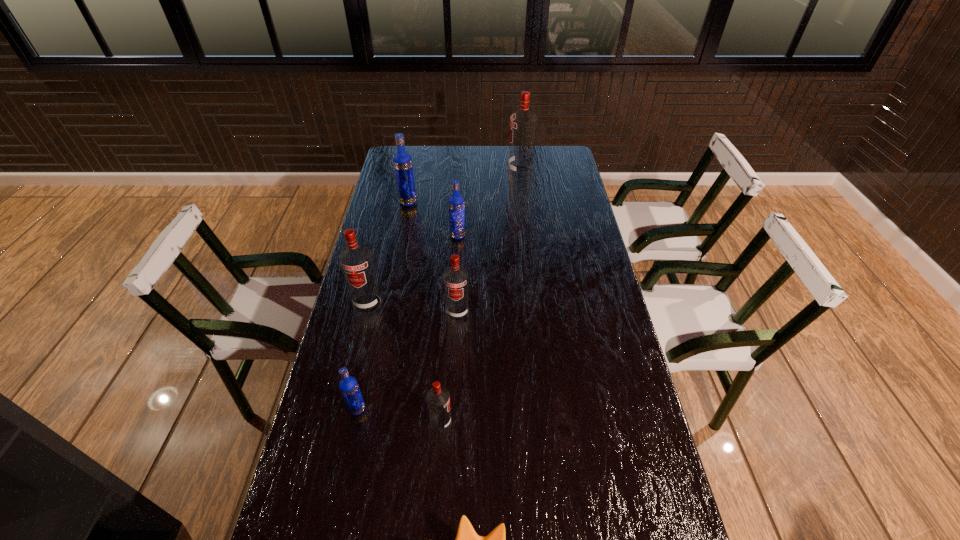
Where is `unoccupied position between the farthest object and the leftmost red vodka`? The height and width of the screenshot is (540, 960). unoccupied position between the farthest object and the leftmost red vodka is located at coordinates tap(444, 238).

Identify the location of empty space between the sixth nearest vodka and the third smallest red vodka. This screenshot has height=540, width=960. (388, 253).

Choose which object is the third nearest neighbor to the sixth nearest vodka. Please provide its 2D coordinates. Your answer should be formatted as a tuple, i.e. [(x, y)], where the tuple contains the x and y coordinates of a point satisfying the conditions above.

[(356, 261)]

Select which object appears as the closest to the rightmost red vodka. Please provide its 2D coordinates. Your answer should be formatted as a tuple, i.e. [(x, y)], where the tuple contains the x and y coordinates of a point satisfying the conditions above.

[(456, 204)]

This screenshot has height=540, width=960. Find the location of `the fourth closest vodka relative to the leftmost red vodka`. the fourth closest vodka relative to the leftmost red vodka is located at coordinates (438, 399).

This screenshot has width=960, height=540. Identify the location of the fifth closest vodka relative to the rightmost blue vodka. (348, 385).

This screenshot has height=540, width=960. I want to click on red vodka object that ranks as the closest to the nearest blue vodka, so pos(438,399).

Point out which red vodka is positioned as the nearest to the rightmost vodka. Please provide its 2D coordinates. Your answer should be formatted as a tuple, i.e. [(x, y)], where the tuple contains the x and y coordinates of a point satisfying the conditions above.

[(455, 277)]

Point out which blue vodka is positioned as the nearest to the third biggest red vodka. Please provide its 2D coordinates. Your answer should be formatted as a tuple, i.e. [(x, y)], where the tuple contains the x and y coordinates of a point satisfying the conditions above.

[(456, 204)]

Identify which blue vodka is located as the third nearest to the second smallest red vodka. Please provide its 2D coordinates. Your answer should be formatted as a tuple, i.e. [(x, y)], where the tuple contains the x and y coordinates of a point satisfying the conditions above.

[(402, 161)]